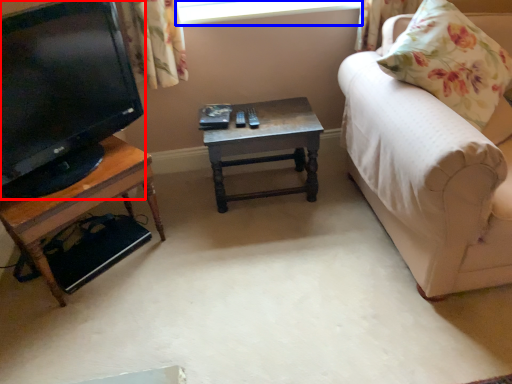
Question: Which of the following is the closest to the observer, television (highlighted by a red box) or window screen (highlighted by a blue box)?

Choices:
 (A) television
 (B) window screen

Answer: (A)